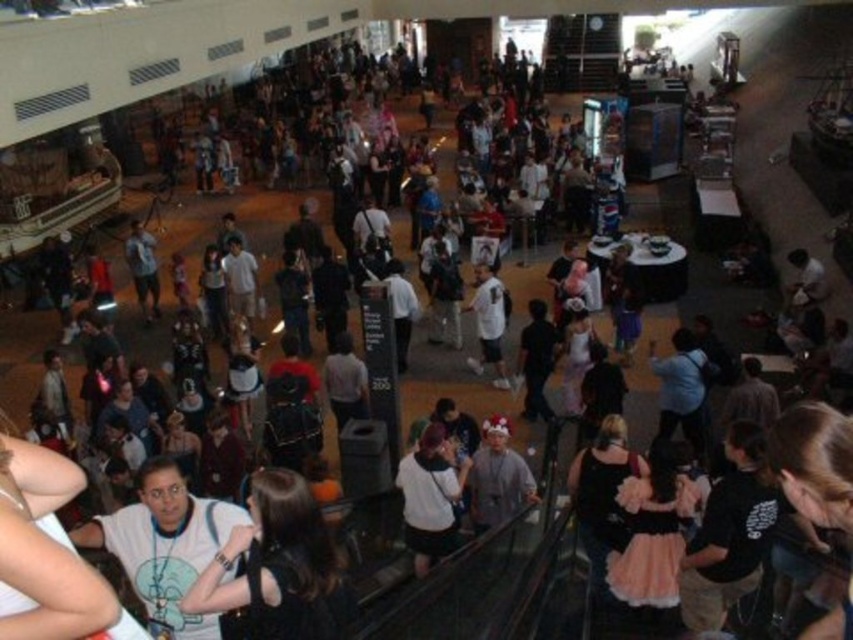
Who is shorter, white cotton shirt at center or white matte shirt at center?

white cotton shirt at center

Is white cotton shirt at center closer to camera compared to white matte shirt at center?

That is True.

At what (x,y) coordinates should I click in order to perform the action: click on white cotton shirt at center. Please return your answer as a coordinate pair (x, y). The image size is (853, 640). Looking at the image, I should click on tap(430, 497).

Can you confirm if white t-shirt at center is positioned below white matte shirt at center?

Yes, white t-shirt at center is below white matte shirt at center.

Between white t-shirt at center and white matte shirt at center, which one appears on the left side from the viewer's perspective?

Positioned to the left is white t-shirt at center.

Between point (302, 634) and point (508, 387), which one is positioned in front?

Point (302, 634) is in front.

What are the coordinates of `white t-shirt at center` in the screenshot? It's located at (277, 564).

Is white matte t-shirt at center closer to the viewer compared to white cotton shirt at center?

Yes, it is in front of white cotton shirt at center.

Between white matte t-shirt at center and white cotton shirt at center, which one has more height?

white cotton shirt at center

Locate an element on the screen. Image resolution: width=853 pixels, height=640 pixels. white matte t-shirt at center is located at coordinates (165, 544).